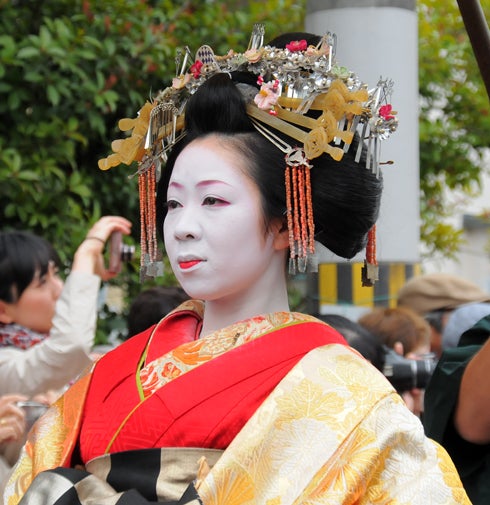
Where is `red robe`? The width and height of the screenshot is (490, 505). red robe is located at coordinates (207, 379).